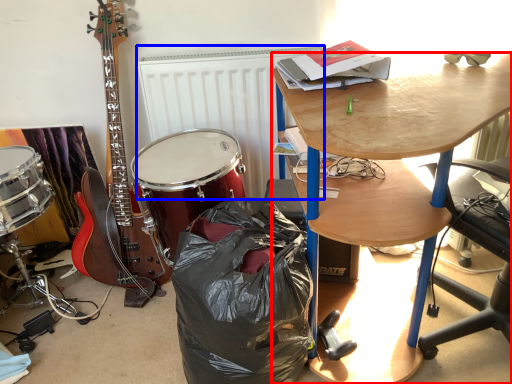
Question: Among these objects, which one is nearest to the camera, desk (highlighted by a red box) or radiator (highlighted by a blue box)?

Choices:
 (A) desk
 (B) radiator

Answer: (A)